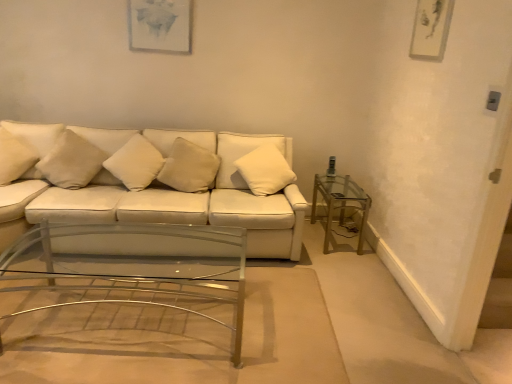
Question: From the image's perspective, is beige fabric pillow at left, the second pillow when ordered from left to right, located above or below beige fabric pillow at center, which is the 4th pillow from left to right?

Choices:
 (A) below
 (B) above

Answer: (B)

Question: Considering their positions, is beige fabric pillow at left, the 4th pillow in the right-to-left sequence, located in front of or behind beige fabric pillow at center, arranged as the 2th pillow when viewed from the right?

Choices:
 (A) front
 (B) behind

Answer: (A)

Question: Estimate the real-world distances between objects in this image. Which object is closer to the clear glass table at right?

Choices:
 (A) beige fabric pillow at center, arranged as the 2th pillow when viewed from the right
 (B) white soft cushion at center, the third pillow positioned from the left
 (C) white matte pillow at left, positioned as the fifth pillow in right-to-left order
 (D) clear glass coffee table at center
 (E) beige fabric pillow at left, the second pillow when ordered from left to right

Answer: (A)

Question: Which object is positioned closest to the white matte pillow at left, marked as the first pillow in a left-to-right arrangement?

Choices:
 (A) white soft pillow at center, which appears as the fifth pillow when viewed from the left
 (B) clear glass coffee table at center
 (C) white soft cushion at center, which ranks as the 3th pillow in right-to-left order
 (D) white leather couch at center
 (E) beige fabric pillow at left, the 4th pillow in the right-to-left sequence

Answer: (E)